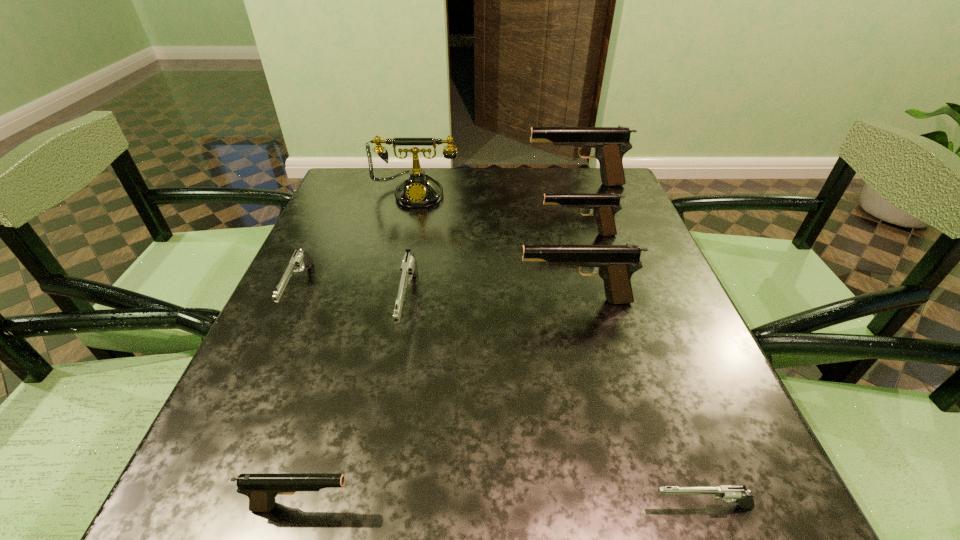
At what (x,y) coordinates should I click in order to perform the action: click on telephone. Please return your answer as a coordinate pair (x, y). Looking at the image, I should click on (x=417, y=190).

The height and width of the screenshot is (540, 960). What are the coordinates of `the biggest black pistol` in the screenshot? It's located at (610, 144).

Identify the location of the tallest pistol. (610, 144).

Locate an element on the screen. The image size is (960, 540). the second biggest black pistol is located at coordinates (615, 264).

In order to click on the sixth shortest object in this screenshot , I will do `click(615, 264)`.

This screenshot has width=960, height=540. Identify the location of the third farthest object. (604, 207).

Locate an element on the screen. The image size is (960, 540). the second farthest black pistol is located at coordinates (604, 207).

Locate an element on the screen. the second silver pistol from right to left is located at coordinates (408, 268).

Locate an element on the screen. This screenshot has height=540, width=960. the biggest silver pistol is located at coordinates (408, 268).

Locate an element on the screen. the smallest black pistol is located at coordinates (261, 489).